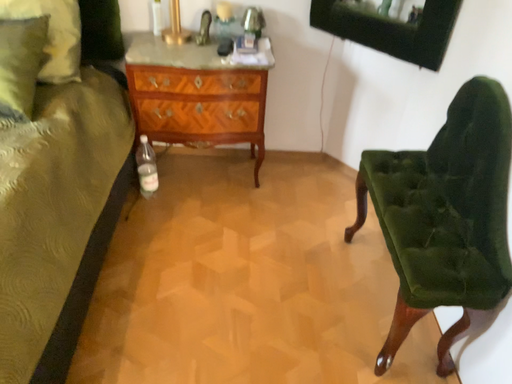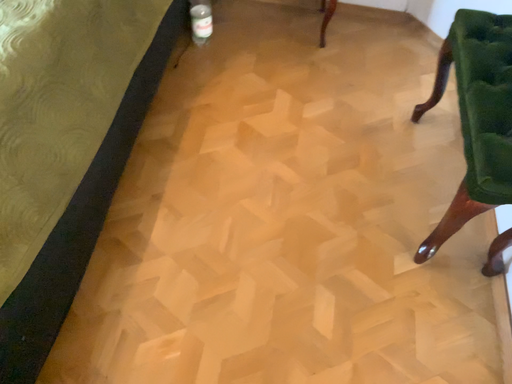
Question: Which way did the camera rotate in the video?

Choices:
 (A) rotated downward
 (B) rotated upward

Answer: (A)